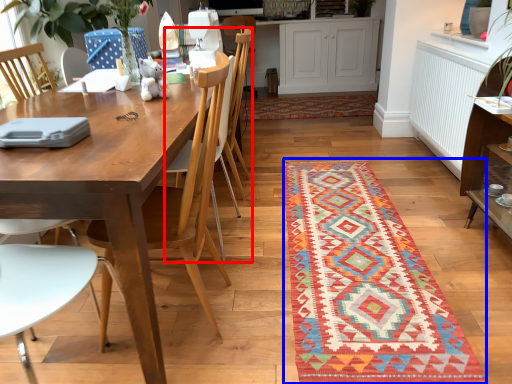
Question: Which of the following is the closest to the observer, armchair (highlighted by a red box) or mat (highlighted by a blue box)?

Choices:
 (A) armchair
 (B) mat

Answer: (B)